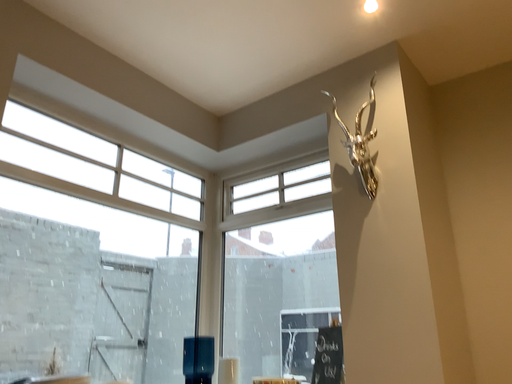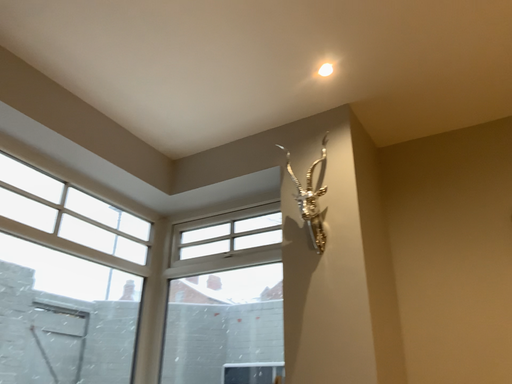
Question: How did the camera likely rotate when shooting the video?

Choices:
 (A) rotated left
 (B) rotated right

Answer: (B)